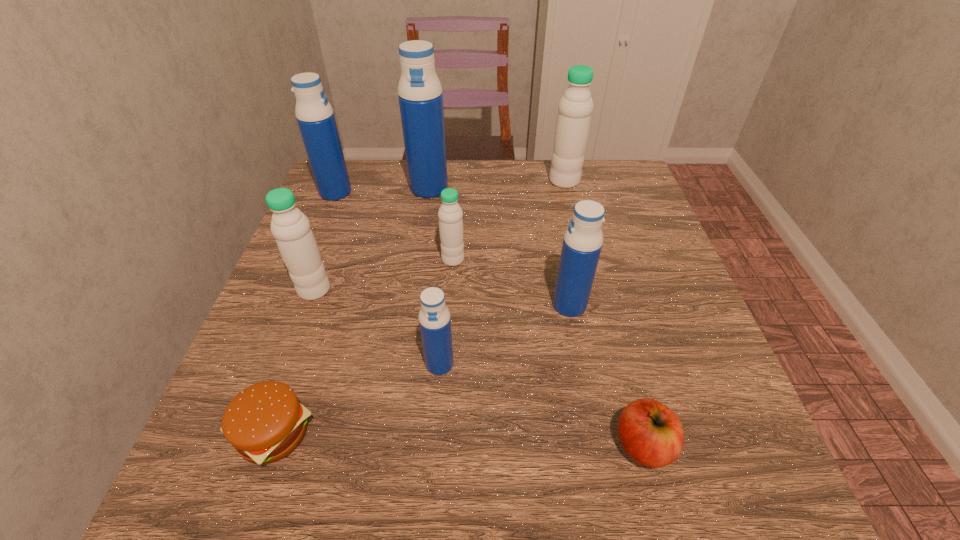
You are a GUI agent. You are given a task and a screenshot of the screen. Output one action in this format:
    pyautogui.click(x=<x>, y=<y>)
    Task: Click on the vacant space located on the right of the fourth nearest water bottle
    The height and width of the screenshot is (540, 960).
    Given the screenshot: What is the action you would take?
    pyautogui.click(x=492, y=259)

Identify the location of free space located 0.390m on the back of the smallest blue water bottle. This screenshot has width=960, height=540. (450, 221).

Locate an element on the screen. This screenshot has height=540, width=960. free space located 0.200m on the back of the eighth tallest object is located at coordinates (610, 321).

Where is `vacant space located on the back of the hamburger`? vacant space located on the back of the hamburger is located at coordinates (337, 251).

Where is `apple that is at the near edge`? Image resolution: width=960 pixels, height=540 pixels. apple that is at the near edge is located at coordinates (652, 434).

Locate an element on the screen. hamburger that is at the near edge is located at coordinates (265, 422).

Locate an element on the screen. The height and width of the screenshot is (540, 960). hamburger located in the left edge section of the desktop is located at coordinates (265, 422).

The width and height of the screenshot is (960, 540). What are the coordinates of `water bottle that is at the right edge` in the screenshot? It's located at 575,107.

The width and height of the screenshot is (960, 540). In order to click on apple located at the right edge in this screenshot , I will do `click(652, 434)`.

Find the location of `object at the far left corner`. object at the far left corner is located at coordinates (314, 114).